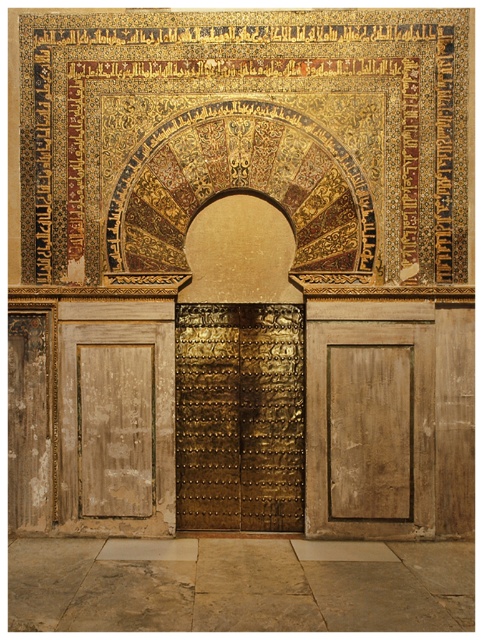
Looking at this image, you are an architect designing a new building inspired by Islamic artistry. You have two gold elements to place in your design. The gold mosaic at upper center and the gold textured door at center. Which of these elements should you make larger to stay true to the original architectural style depicted in the image?

The gold mosaic at upper center should be made larger since in the original image, it has a larger size compared to the gold textured door at center.

You are an architect designing a replica of this doorway. You need to ensure that the gold textured door at center and wooden panel at left are proportionally accurate. Which object should you scale down to match the original proportions?

The gold textured door at center is bigger than wooden panel at left, so you should scale down the gold textured door at center to match the original proportions.

You are an architect examining the intricate archway and need to install a sensor at point (x=34, y=99) and another at point (x=200, y=512). From the observer standing in front of the archway, which sensor will be closer to the viewer?

Point (x=34, y=99) is in front of point (x=200, y=512), so the sensor at point (x=34, y=99) will be closer to the viewer.